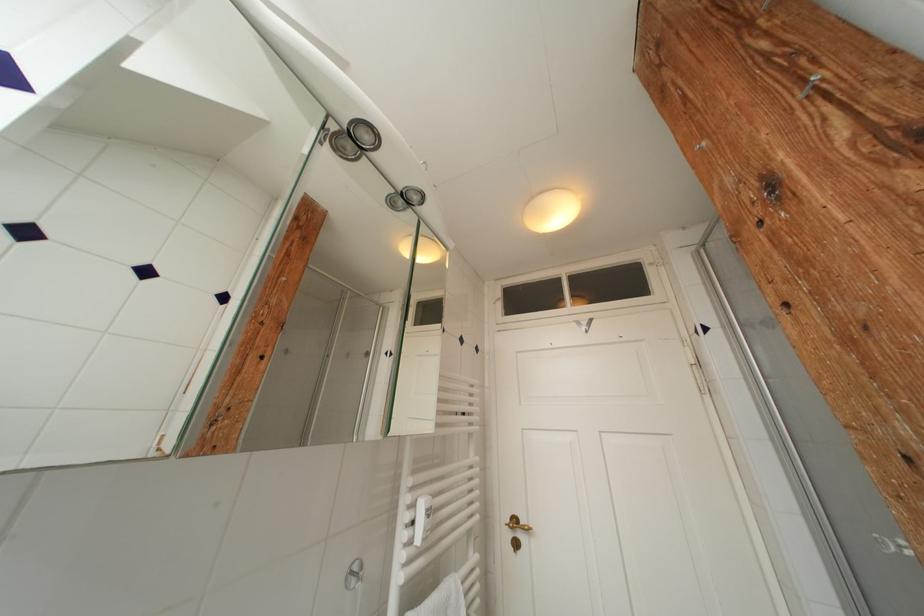
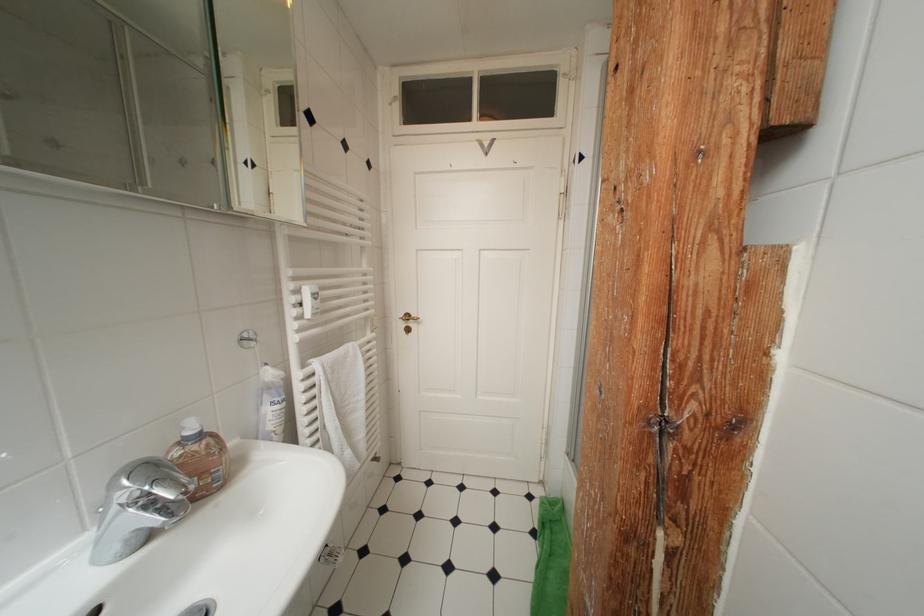
Where in the second image is the point corresponding to point (393, 358) from the first image?

(253, 167)